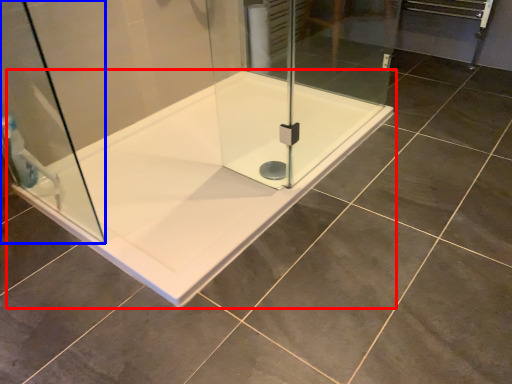
Question: Which point is further to the camera, bathtub (highlighted by a red box) or shower door (highlighted by a blue box)?

Choices:
 (A) bathtub
 (B) shower door

Answer: (A)